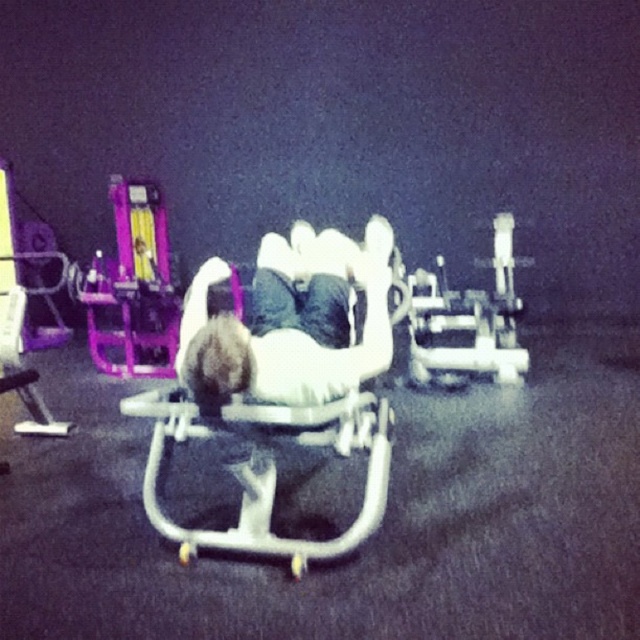
Question: Can you confirm if white matte bench at center is bigger than white plastic sleigh at center?

Choices:
 (A) no
 (B) yes

Answer: (B)

Question: Which object is closer to the camera taking this photo?

Choices:
 (A) white plastic sleigh at center
 (B) white matte bench at center

Answer: (B)

Question: Does white matte bench at center appear on the left side of white plastic sleigh at center?

Choices:
 (A) yes
 (B) no

Answer: (B)

Question: Does white matte bench at center appear on the left side of white plastic sleigh at center?

Choices:
 (A) no
 (B) yes

Answer: (A)

Question: Which point is closer to the camera?

Choices:
 (A) (272, 362)
 (B) (237, 426)

Answer: (B)